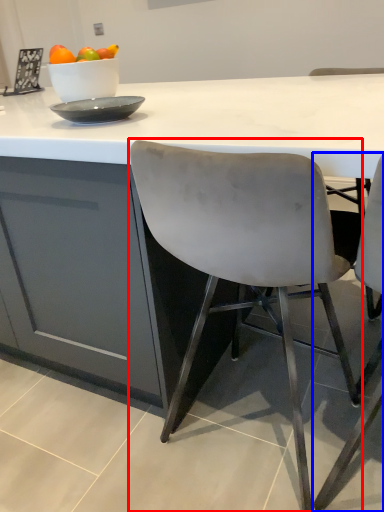
Question: Which object appears farthest to the camera in this image, chair (highlighted by a red box) or chair (highlighted by a blue box)?

Choices:
 (A) chair
 (B) chair

Answer: (A)